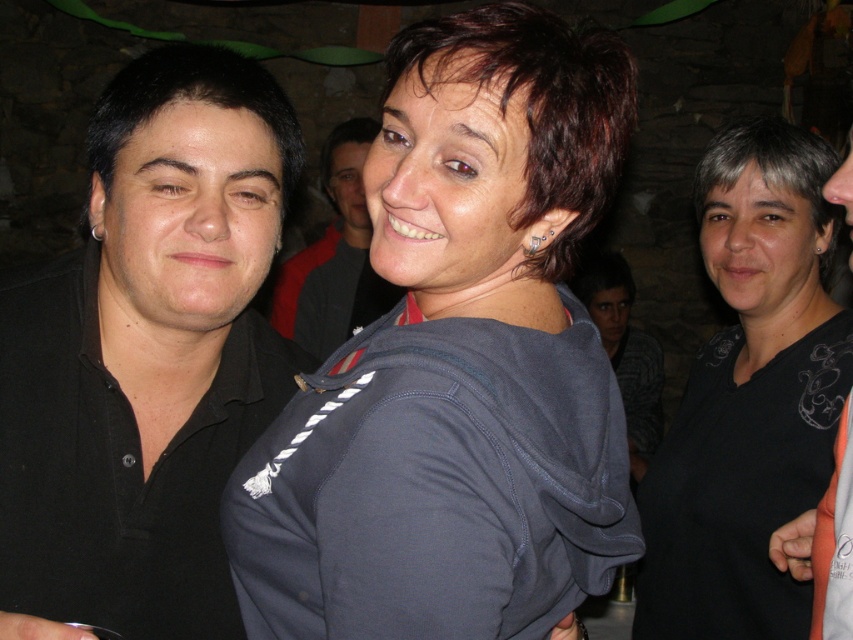
You are standing at the origin point in the image. Which of the two points, point [699,240] or point [347,152], is closer to you?

Point [699,240] is closer to you because it is in front of point [347,152].

You are standing at the back of the room and want to greet both the black matte shirt at left and the gray striped sweater at center. Which one should you approach first to reach them in the shortest path?

The black matte shirt at left is in front of the gray striped sweater at center, so you should approach the black matte shirt at left first as it is closer to you.